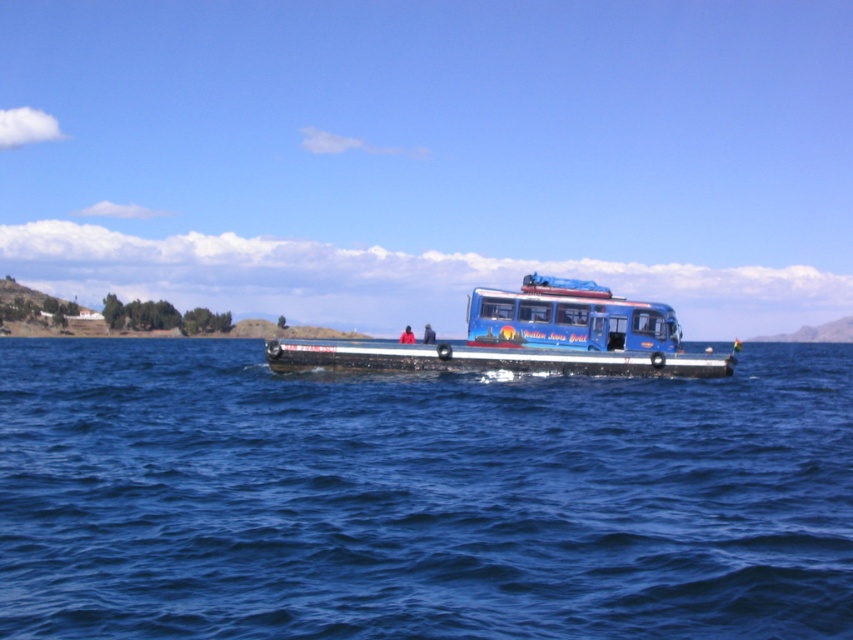
Question: Does blue water at center appear over blue matte bus at center?

Choices:
 (A) no
 (B) yes

Answer: (A)

Question: In this image, where is blue water at center located relative to blue matte bus at center?

Choices:
 (A) below
 (B) above

Answer: (A)

Question: Is blue water at center below blue matte bus at center?

Choices:
 (A) no
 (B) yes

Answer: (B)

Question: Among these points, which one is farthest from the camera?

Choices:
 (A) (639, 512)
 (B) (645, 364)

Answer: (B)

Question: Which object is closer to the camera taking this photo?

Choices:
 (A) blue matte bus at center
 (B) blue water at center

Answer: (B)